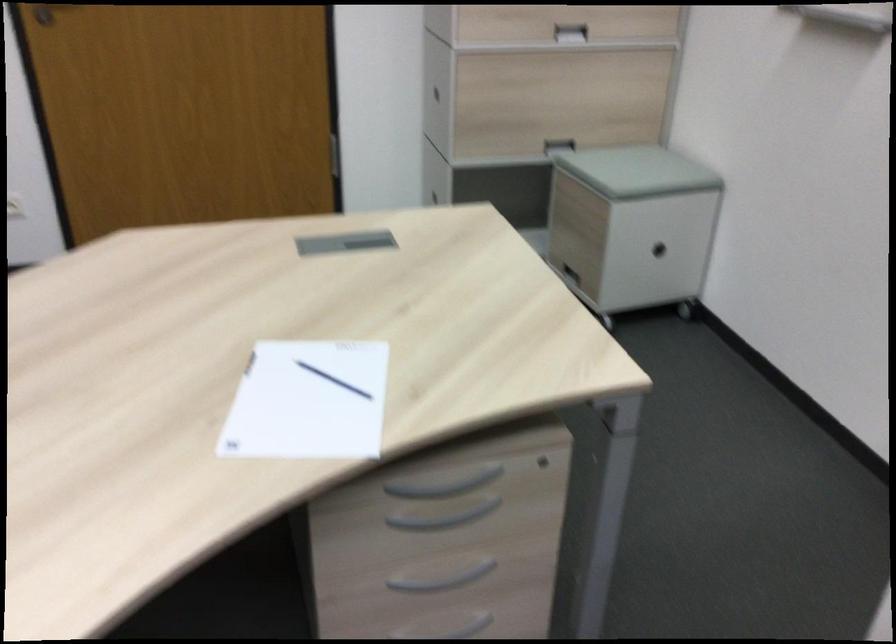
The width and height of the screenshot is (896, 644). What do you see at coordinates (570, 33) in the screenshot? I see `a recessed cabinet handle` at bounding box center [570, 33].